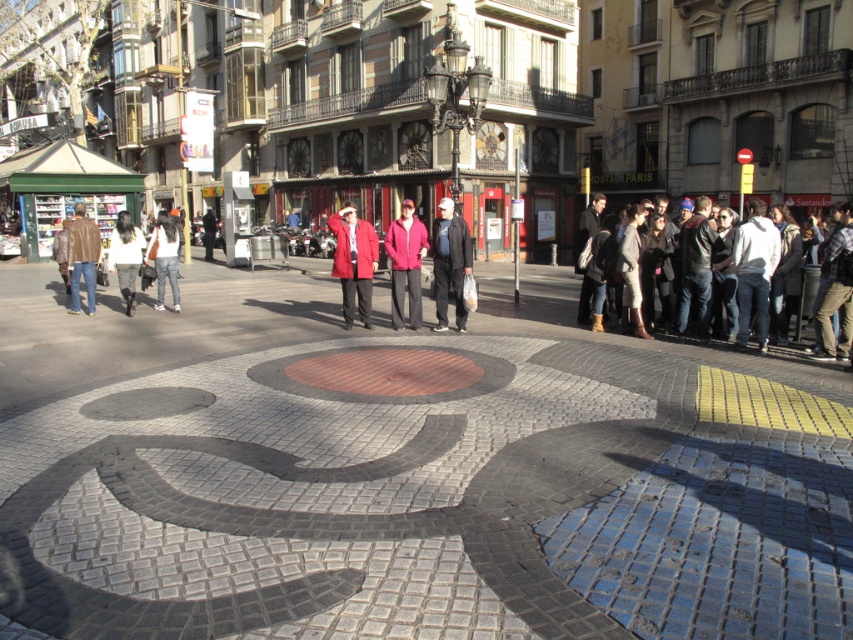
You are a fashion designer observing the crowd in the urban scene. You notice two individuals wearing a matte pink jacket at center and a white fur coat at center. Which of these two garments appears to be wider when viewed from your perspective?

The white fur coat at center is wider than the matte pink jacket at center.

You are standing at the center of the mosaic pavement in the urban scene. You see a brown leather jacket at left. Where exactly is the point at coordinate (82, 257) located on the brown leather jacket at left?

The point at coordinate (82, 257) is located on the brown leather jacket at left.